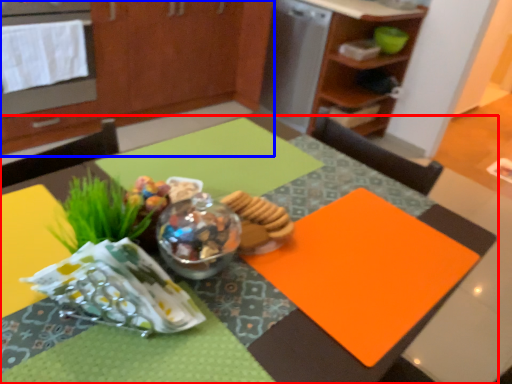
Question: Which object is further to the camera taking this photo, table (highlighted by a red box) or cabinetry (highlighted by a blue box)?

Choices:
 (A) table
 (B) cabinetry

Answer: (B)